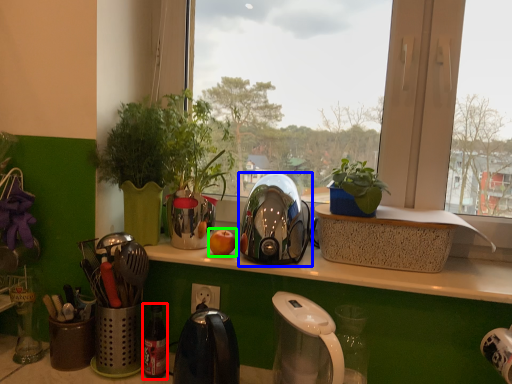
Question: Based on their relative distances, which object is farther from bottle (highlighted by a red box)? Choose from kettle (highlighted by a blue box) and apple (highlighted by a green box).

Choices:
 (A) kettle
 (B) apple

Answer: (A)